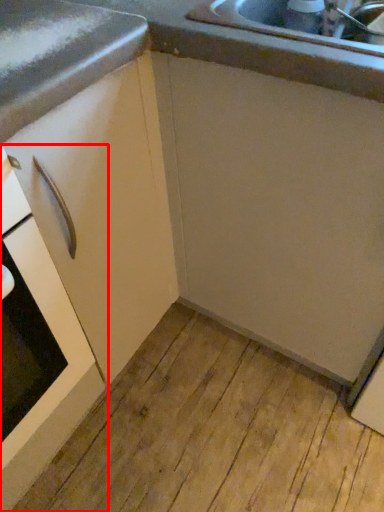
Question: From the image's perspective, where is home appliance (annotated by the red box) located in relation to cabinetry in the image?

Choices:
 (A) below
 (B) above

Answer: (A)